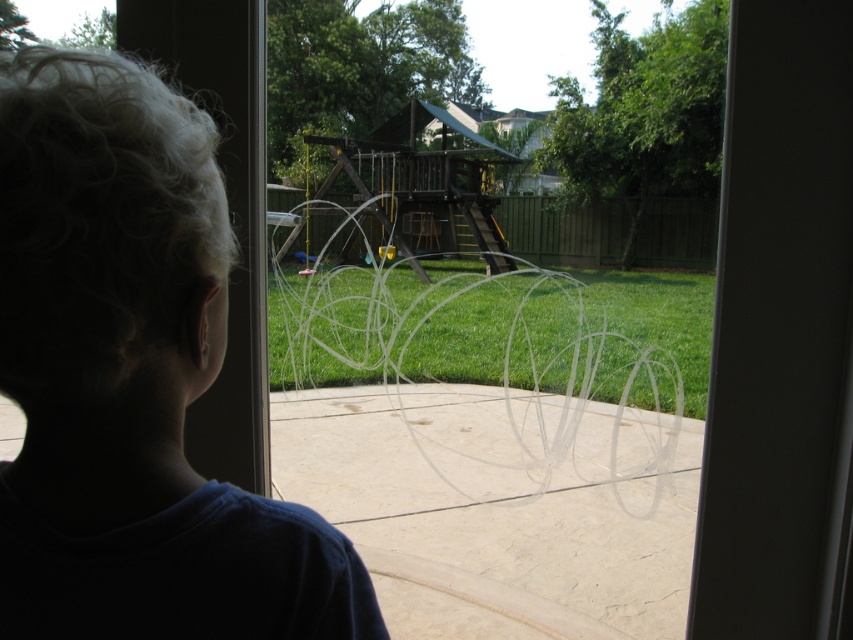
You are a delivery person trying to locate the homeowner. You see the dark blue shirt at left and the transparent plastic screen door at center. Which object is closer to the front of the house?

The dark blue shirt at left is located above the transparent plastic screen door at center, meaning it is closer to the front of the house since objects higher in the frame are typically closer in such perspectives.

You are a photographer standing in front of the window. You want to take a picture of the dark blue shirt at left without including the window reflection. Can you move closer to the shirt to achieve this?

The dark blue shirt at left is 17.68 inches away from the camera. Moving closer would require reducing this distance, but since the window itself is between you and the shirt, physically moving closer isn

Consider the image. You are a delivery person trying to deliver a package to the house. You see the transparent plastic screen door at center and the green grass at center through the window. Which one is wider?

The transparent plastic screen door at center is less wide than the green grass at center, so the green grass at center is wider.